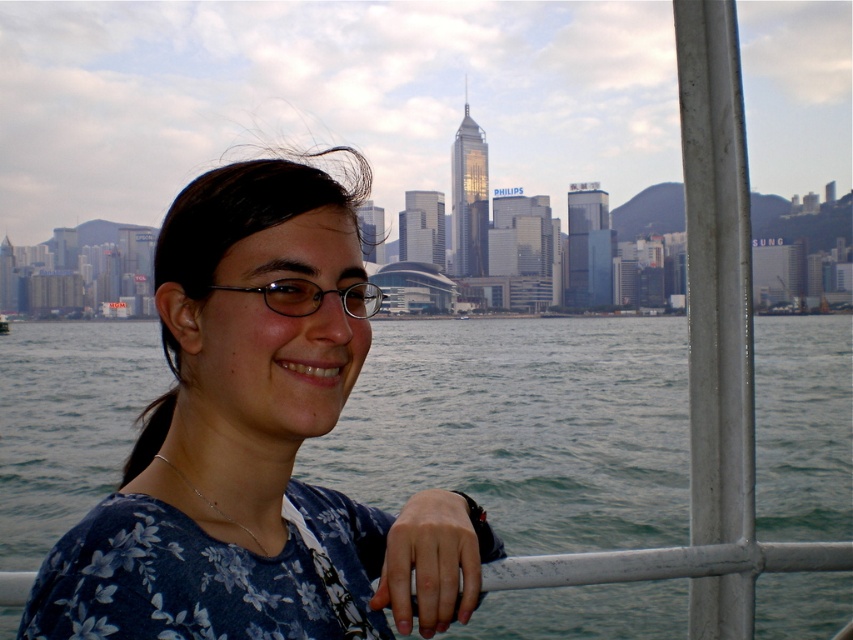
Question: Estimate the real-world distances between objects in this image. Which object is farther from the clear plastic glasses at center?

Choices:
 (A) blue floral shirt at center
 (B) greenish-blue water at center

Answer: (B)

Question: Does greenish-blue water at center appear on the left side of clear plastic glasses at center?

Choices:
 (A) yes
 (B) no

Answer: (B)

Question: Considering the real-world distances, which object is closest to the blue floral shirt at center?

Choices:
 (A) clear plastic glasses at center
 (B) greenish-blue water at center

Answer: (A)

Question: Is greenish-blue water at center below clear plastic glasses at center?

Choices:
 (A) yes
 (B) no

Answer: (A)

Question: Considering the real-world distances, which object is closest to the greenish-blue water at center?

Choices:
 (A) clear plastic glasses at center
 (B) blue floral shirt at center

Answer: (B)

Question: Can you confirm if blue floral shirt at center is smaller than clear plastic glasses at center?

Choices:
 (A) yes
 (B) no

Answer: (B)